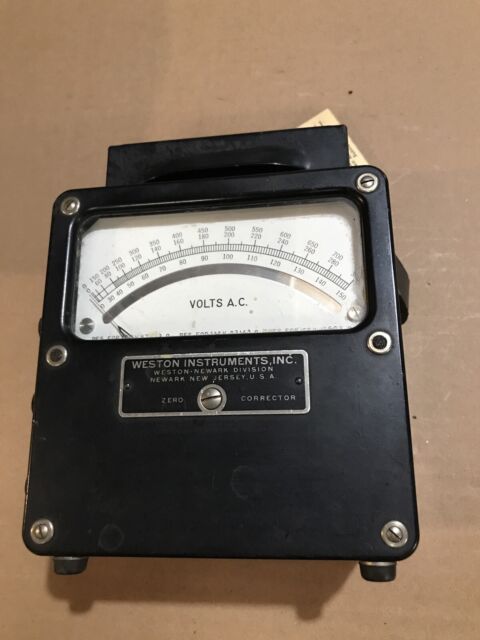
Where is `top right screw`? The height and width of the screenshot is (640, 480). top right screw is located at coordinates (369, 180).